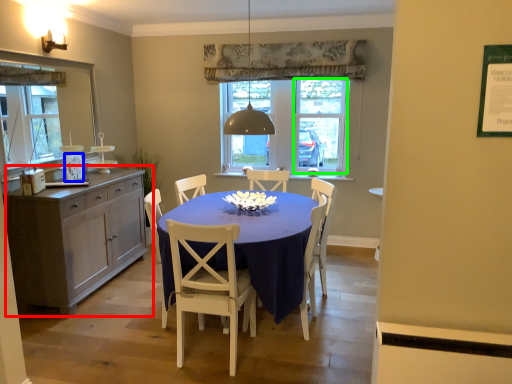
Question: Considering the real-world distances, which object is closest to cabinetry (highlighted by a red box)? picture frame (highlighted by a blue box) or glass door (highlighted by a green box).

Choices:
 (A) picture frame
 (B) glass door

Answer: (A)